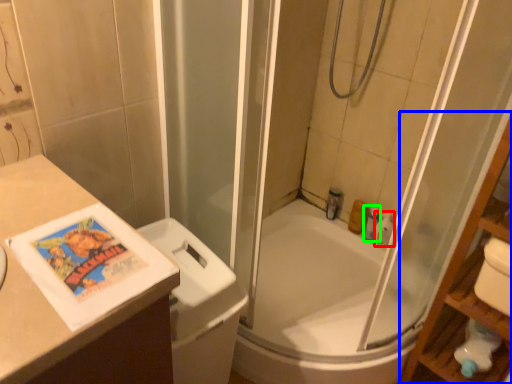
Question: Estimate the real-world distances between objects in this image. Which object is farther from toiletry (highlighted by a red box), shelf (highlighted by a blue box) or toiletry (highlighted by a green box)?

Choices:
 (A) shelf
 (B) toiletry

Answer: (A)